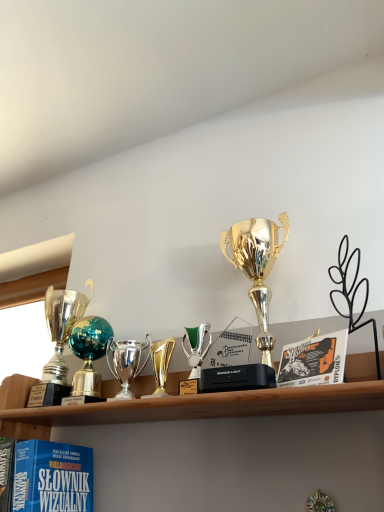
Question: Can you confirm if polished silver trophy at center, acting as the 3th trophy starting from the right, is bigger than metallic trophy at left?

Choices:
 (A) no
 (B) yes

Answer: (A)

Question: Considering the relative sizes of polished silver trophy at center, placed as the second trophy when sorted from left to right, and metallic trophy at left in the image provided, is polished silver trophy at center, placed as the second trophy when sorted from left to right, smaller than metallic trophy at left?

Choices:
 (A) yes
 (B) no

Answer: (A)

Question: Does polished silver trophy at center, placed as the second trophy when sorted from left to right, have a greater width compared to metallic trophy at left?

Choices:
 (A) no
 (B) yes

Answer: (A)

Question: Is polished silver trophy at center, acting as the 3th trophy starting from the right, not close to metallic trophy at left?

Choices:
 (A) no
 (B) yes

Answer: (A)

Question: Considering the relative sizes of polished silver trophy at center, acting as the 3th trophy starting from the right, and metallic trophy at left in the image provided, is polished silver trophy at center, acting as the 3th trophy starting from the right, taller than metallic trophy at left?

Choices:
 (A) yes
 (B) no

Answer: (B)

Question: Does polished silver trophy at center, acting as the 3th trophy starting from the right, have a lesser height compared to metallic trophy at left?

Choices:
 (A) yes
 (B) no

Answer: (A)

Question: Does gold shiny trophy at center, which is counted as the 1th trophy, starting from the right, have a lesser height compared to polished silver trophy at center, acting as the 3th trophy starting from the right?

Choices:
 (A) yes
 (B) no

Answer: (B)

Question: Is the position of gold shiny trophy at center, marked as the 4th trophy in a left-to-right arrangement, more distant than that of polished silver trophy at center, acting as the 3th trophy starting from the right?

Choices:
 (A) no
 (B) yes

Answer: (A)

Question: Is gold shiny trophy at center, which is counted as the 1th trophy, starting from the right, not near polished silver trophy at center, placed as the second trophy when sorted from left to right?

Choices:
 (A) yes
 (B) no

Answer: (B)

Question: Does gold shiny trophy at center, which is counted as the 1th trophy, starting from the right, have a smaller size compared to polished silver trophy at center, placed as the second trophy when sorted from left to right?

Choices:
 (A) no
 (B) yes

Answer: (A)

Question: Considering the relative sizes of gold shiny trophy at center, which is counted as the 1th trophy, starting from the right, and polished silver trophy at center, acting as the 3th trophy starting from the right, in the image provided, is gold shiny trophy at center, which is counted as the 1th trophy, starting from the right, thinner than polished silver trophy at center, acting as the 3th trophy starting from the right,?

Choices:
 (A) yes
 (B) no

Answer: (B)

Question: Can you confirm if gold shiny trophy at center, which is counted as the 1th trophy, starting from the right, is bigger than polished silver trophy at center, placed as the second trophy when sorted from left to right?

Choices:
 (A) yes
 (B) no

Answer: (A)

Question: Does polished silver trophy at center, acting as the 3th trophy starting from the right, have a larger size compared to gold shiny trophy at center, placed as the 2th trophy when sorted from right to left?

Choices:
 (A) no
 (B) yes

Answer: (B)